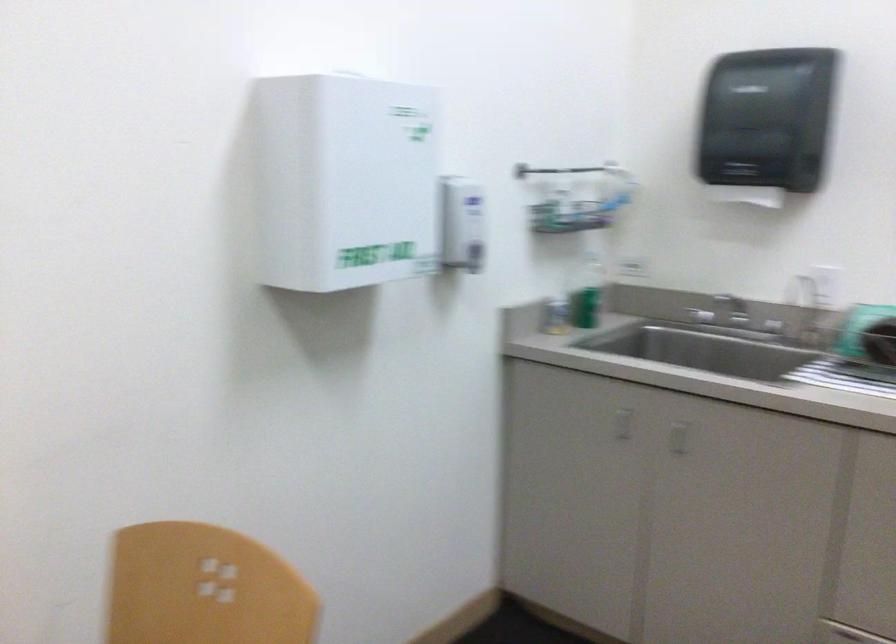
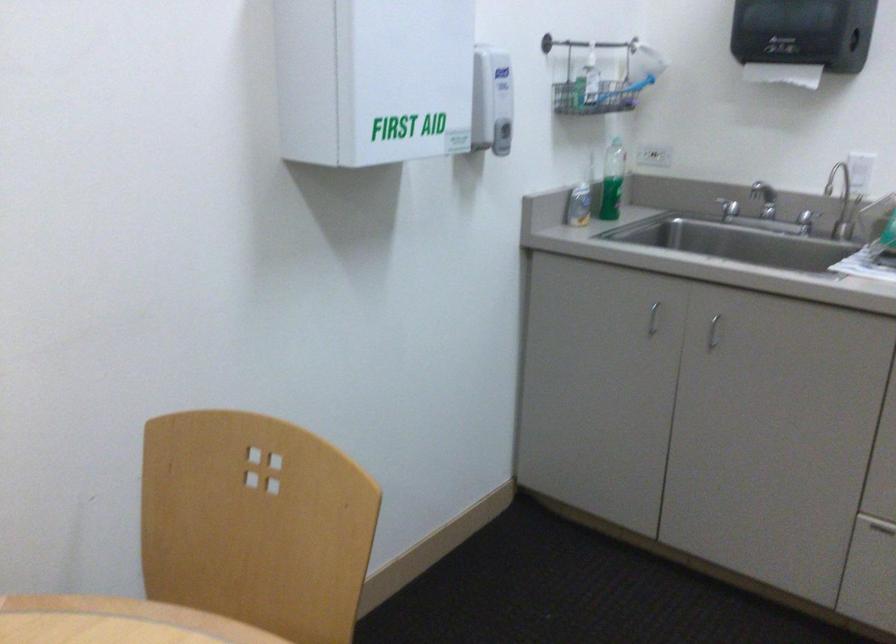
The point at (693, 319) is marked in the first image. Where is the corresponding point in the second image?

(728, 207)